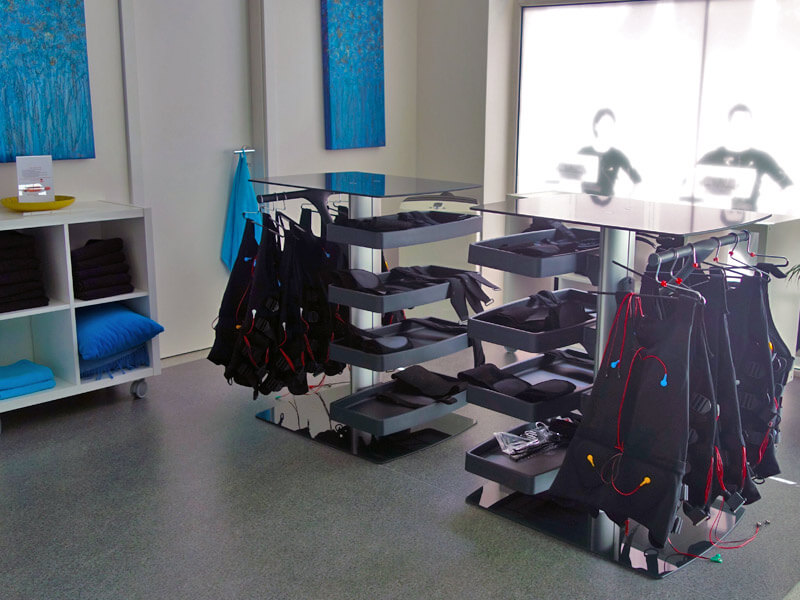
The image size is (800, 600). I want to click on handle, so click(249, 152).